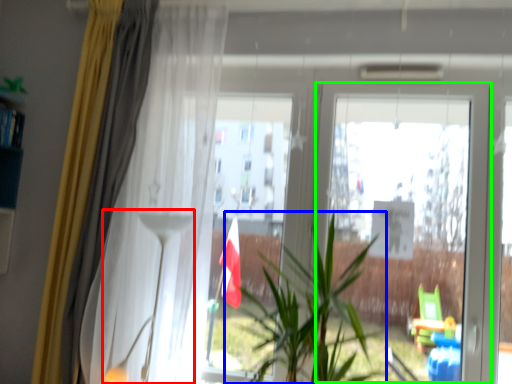
Question: Which is farther away from lamp (highlighted by a red box)? houseplant (highlighted by a blue box) or screen door (highlighted by a green box)?

Choices:
 (A) houseplant
 (B) screen door

Answer: (B)